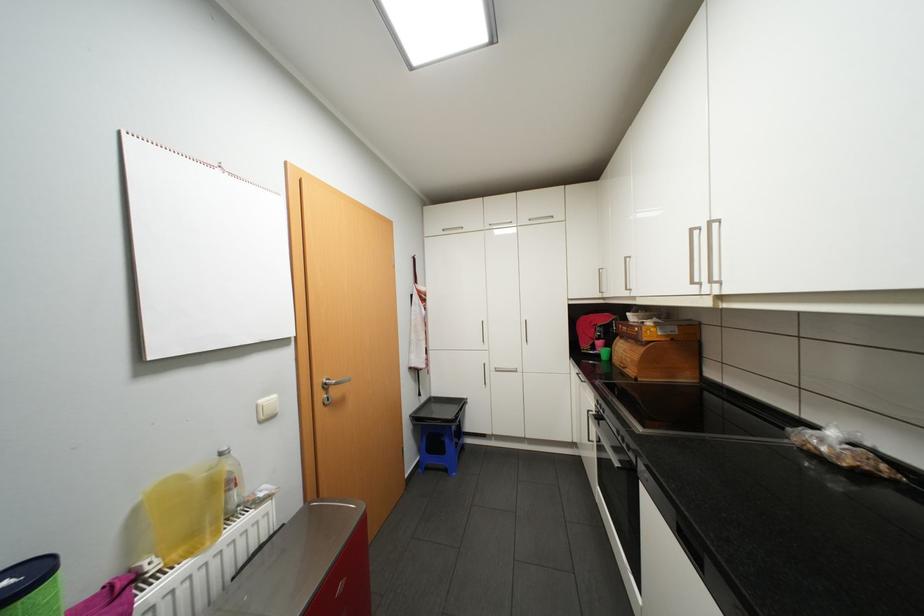
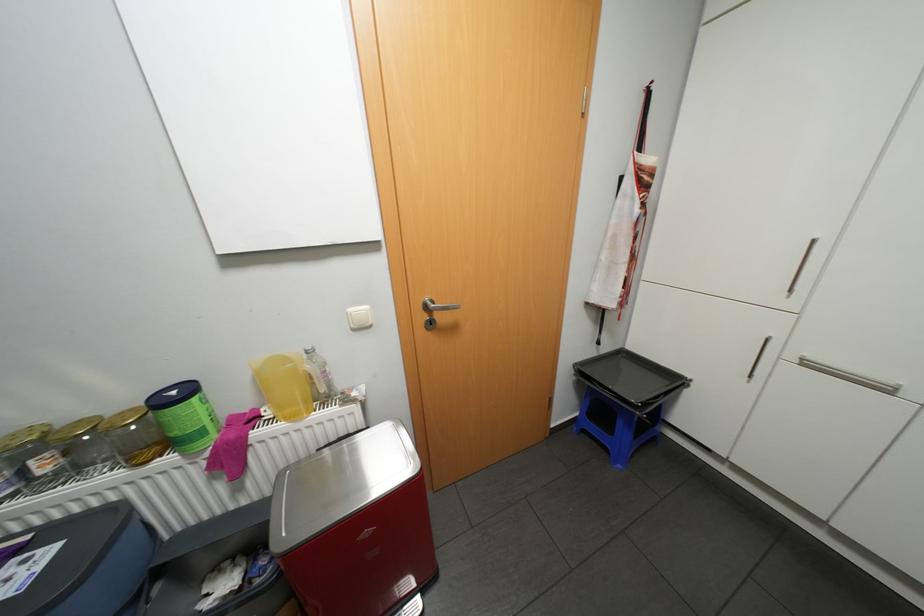
In the second image, find the point that corresponds to [162,565] in the first image.

(275, 413)